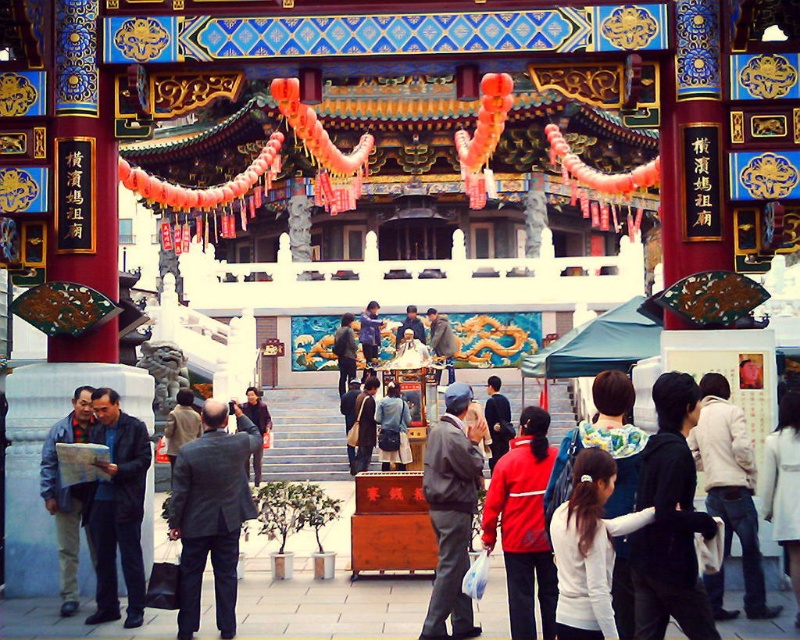
Does white fabric hairband at center have a greater height compared to denim jacket at lower right?

No.

Is white fabric hairband at center to the right of denim jacket at lower right from the viewer's perspective?

No, white fabric hairband at center is not to the right of denim jacket at lower right.

Who is more forward, [596,566] or [754,529]?

Point [596,566]

The width and height of the screenshot is (800, 640). Identify the location of white fabric hairband at center. (588, 548).

Does black fabric jacket at lower right have a smaller size compared to dark gray suit at center?

Yes, black fabric jacket at lower right is smaller than dark gray suit at center.

Between black fabric jacket at lower right and dark gray suit at center, which one appears on the left side from the viewer's perspective?

Positioned to the left is dark gray suit at center.

Does point (660, 481) lie behind point (266, 426)?

No, it is in front of (266, 426).

Where is `black fabric jacket at lower right`? Image resolution: width=800 pixels, height=640 pixels. black fabric jacket at lower right is located at coordinates (670, 520).

Is red matte jacket at center bigger than gray fabric jacket at center?

No, red matte jacket at center is not bigger than gray fabric jacket at center.

Is red matte jacket at center shorter than gray fabric jacket at center?

Yes, red matte jacket at center is shorter than gray fabric jacket at center.

Does point (482, 547) lie in front of point (440, 589)?

Yes.

Locate an element on the screen. red matte jacket at center is located at coordinates (524, 524).